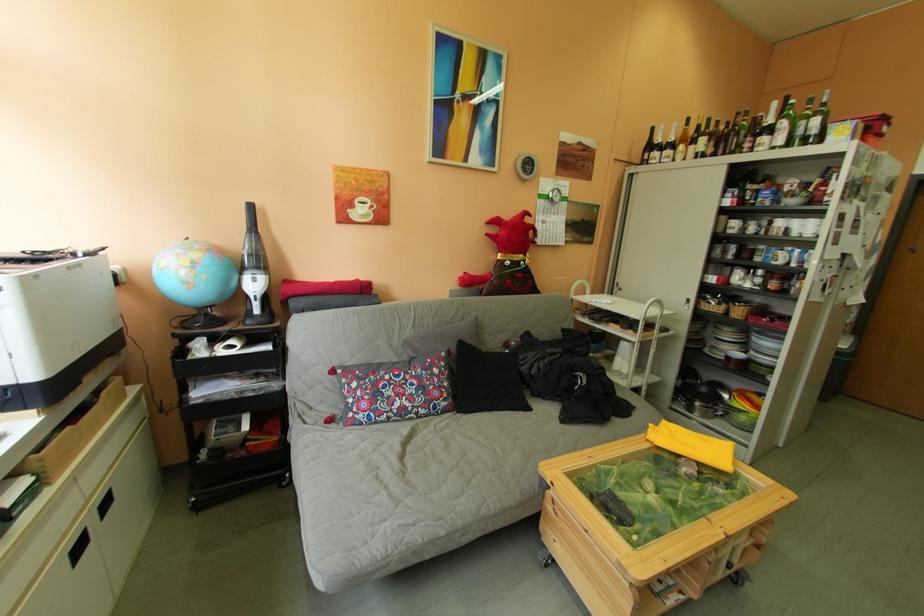
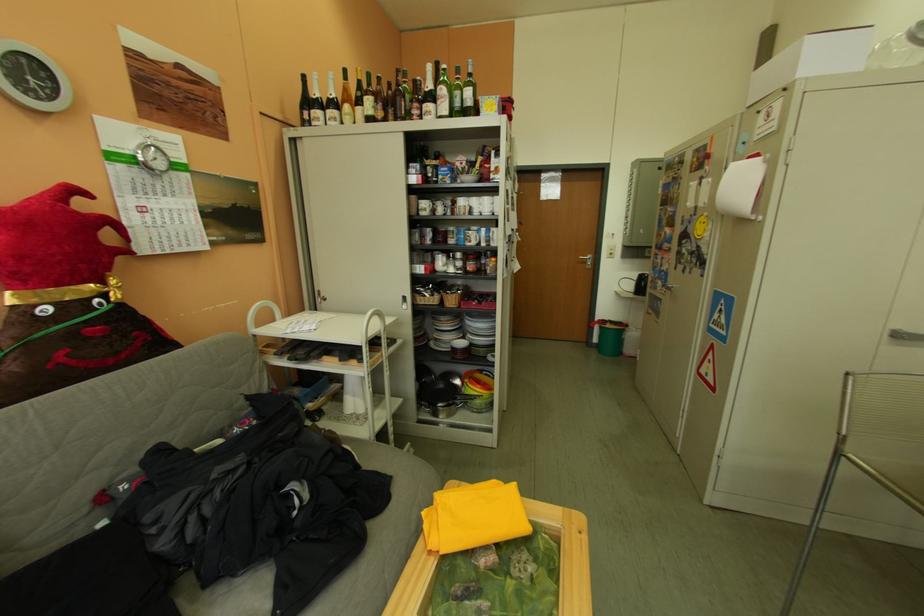
Find the pixel in the second image that matches pixel 562 363 in the first image.

(234, 493)